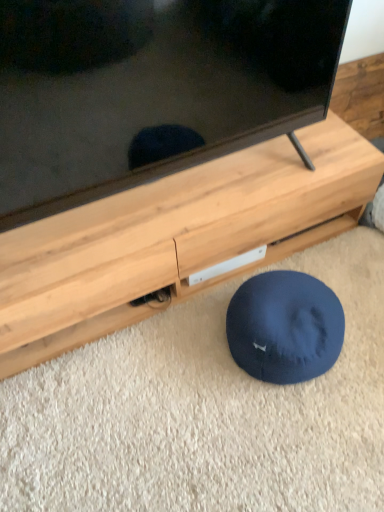
Identify the location of navy blue fabric dog bed at lower center. click(285, 327).

Image resolution: width=384 pixels, height=512 pixels. I want to click on black glossy tv at upper center, so click(x=150, y=89).

Is wooden tv stand at center not inside black glossy tv at upper center?

Yes.

Considering the sizes of wooden tv stand at center and black glossy tv at upper center in the image, is wooden tv stand at center bigger or smaller than black glossy tv at upper center?

In the image, wooden tv stand at center appears to be smaller than black glossy tv at upper center.

Looking at their sizes, would you say wooden tv stand at center is wider or thinner than black glossy tv at upper center?

In the image, wooden tv stand at center appears to be wider than black glossy tv at upper center.

Is black glossy tv at upper center to the left or to the right of navy blue fabric dog bed at lower center in the image?

In the image, black glossy tv at upper center appears on the left side of navy blue fabric dog bed at lower center.

Is point (100, 157) in front of point (266, 283)?

Yes, it is.

In the scene shown: Which object is further away from the camera taking this photo, black glossy tv at upper center or navy blue fabric dog bed at lower center?

Positioned behind is navy blue fabric dog bed at lower center.

From a real-world perspective, does black glossy tv at upper center sit lower than navy blue fabric dog bed at lower center?

No, from a real-world perspective, black glossy tv at upper center is not below navy blue fabric dog bed at lower center.

Which of these two, navy blue fabric dog bed at lower center or wooden tv stand at center, stands taller?

Standing taller between the two is wooden tv stand at center.

The width and height of the screenshot is (384, 512). Identify the location of furniture located above the navy blue fabric dog bed at lower center (from the image's perspective). (175, 238).

Can you confirm if navy blue fabric dog bed at lower center is positioned to the right of wooden tv stand at center?

Indeed, navy blue fabric dog bed at lower center is positioned on the right side of wooden tv stand at center.

Are navy blue fabric dog bed at lower center and wooden tv stand at center located far from each other?

navy blue fabric dog bed at lower center is near wooden tv stand at center, not far away.

Could you tell me if black glossy tv at upper center is facing wooden tv stand at center?

No, black glossy tv at upper center does not turn towards wooden tv stand at center.

Is black glossy tv at upper center bigger or smaller than wooden tv stand at center?

Clearly, black glossy tv at upper center is larger in size than wooden tv stand at center.

The height and width of the screenshot is (512, 384). Find the location of `furniture lying on the right of black glossy tv at upper center`. furniture lying on the right of black glossy tv at upper center is located at coordinates 175,238.

From the image's perspective, relative to navy blue fabric dog bed at lower center, is wooden tv stand at center above or below?

From the image's perspective, wooden tv stand at center appears above navy blue fabric dog bed at lower center.

Consider the image. Does wooden tv stand at center have a larger size compared to navy blue fabric dog bed at lower center?

Correct, wooden tv stand at center is larger in size than navy blue fabric dog bed at lower center.

Considering the relative positions of wooden tv stand at center and navy blue fabric dog bed at lower center in the image provided, is wooden tv stand at center to the right of navy blue fabric dog bed at lower center from the viewer's perspective?

In fact, wooden tv stand at center is to the left of navy blue fabric dog bed at lower center.

Does wooden tv stand at center touch navy blue fabric dog bed at lower center?

No, wooden tv stand at center is not beside navy blue fabric dog bed at lower center.

Which is behind, point (281, 312) or point (91, 188)?

The point (281, 312) is behind.

Does navy blue fabric dog bed at lower center touch black glossy tv at upper center?

They are not placed beside each other.

Where is `television on the left side of wooden tv stand at center`? The width and height of the screenshot is (384, 512). television on the left side of wooden tv stand at center is located at coordinates (150, 89).

This screenshot has height=512, width=384. Find the location of `television above the navy blue fabric dog bed at lower center (from the image's perspective)`. television above the navy blue fabric dog bed at lower center (from the image's perspective) is located at coordinates (150, 89).

Estimate the real-world distances between objects in this image. Which object is further from black glossy tv at upper center, navy blue fabric dog bed at lower center or wooden tv stand at center?

navy blue fabric dog bed at lower center lies further to black glossy tv at upper center than the other object.

Which object lies further to the anchor point black glossy tv at upper center, wooden tv stand at center or navy blue fabric dog bed at lower center?

navy blue fabric dog bed at lower center is positioned further to the anchor black glossy tv at upper center.

Based on the photo, considering their positions, is black glossy tv at upper center positioned further to navy blue fabric dog bed at lower center than wooden tv stand at center?

The object further to navy blue fabric dog bed at lower center is black glossy tv at upper center.

Looking at this image, looking at the image, which one is located further to wooden tv stand at center, navy blue fabric dog bed at lower center or black glossy tv at upper center?

navy blue fabric dog bed at lower center.

Considering their positions, is wooden tv stand at center positioned closer to navy blue fabric dog bed at lower center than black glossy tv at upper center?

Among the two, wooden tv stand at center is located nearer to navy blue fabric dog bed at lower center.

From the image, which object appears to be nearer to wooden tv stand at center, black glossy tv at upper center or navy blue fabric dog bed at lower center?

black glossy tv at upper center is closer to wooden tv stand at center.

What are the coordinates of `furniture that lies between black glossy tv at upper center and navy blue fabric dog bed at lower center from top to bottom` in the screenshot? It's located at (175, 238).